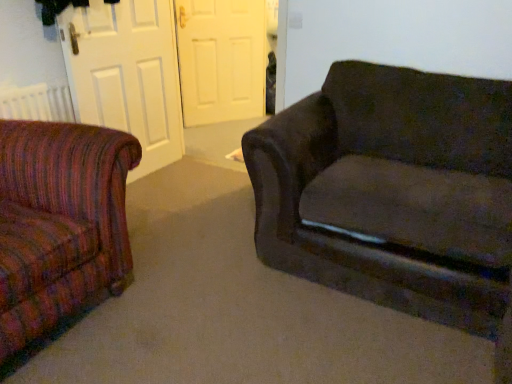
Question: Can you confirm if matte white door at left, which is the second screen door from back to front, is wider than white matte door at center, placed as the 1th screen door when sorted from back to front?

Choices:
 (A) no
 (B) yes

Answer: (A)

Question: Would you say matte white door at left, which ranks as the 1th screen door in front-to-back order, is a long distance from white matte door at center, placed as the 1th screen door when sorted from back to front?

Choices:
 (A) yes
 (B) no

Answer: (A)

Question: Is matte white door at left, which is the second screen door from back to front, surrounding white matte door at center, placed as the 1th screen door when sorted from back to front?

Choices:
 (A) no
 (B) yes

Answer: (A)

Question: Is matte white door at left, which is the second screen door from back to front, taller than white matte door at center, placed as the 1th screen door when sorted from back to front?

Choices:
 (A) no
 (B) yes

Answer: (B)

Question: Is matte white door at left, which ranks as the 1th screen door in front-to-back order, placed right next to white matte door at center, which appears as the second screen door when viewed from the front?

Choices:
 (A) yes
 (B) no

Answer: (B)

Question: Is matte white door at left, which ranks as the 1th screen door in front-to-back order, aimed at white matte door at center, placed as the 1th screen door when sorted from back to front?

Choices:
 (A) no
 (B) yes

Answer: (A)

Question: Does dark fabric couch at right have a greater height compared to white matte door at center, which appears as the second screen door when viewed from the front?

Choices:
 (A) no
 (B) yes

Answer: (A)

Question: Can white matte door at center, placed as the 1th screen door when sorted from back to front, be found inside dark fabric couch at right?

Choices:
 (A) no
 (B) yes

Answer: (A)

Question: From a real-world perspective, is dark fabric couch at right positioned under white matte door at center, placed as the 1th screen door when sorted from back to front, based on gravity?

Choices:
 (A) yes
 (B) no

Answer: (A)

Question: Are dark fabric couch at right and white matte door at center, which appears as the second screen door when viewed from the front, far apart?

Choices:
 (A) yes
 (B) no

Answer: (A)

Question: Does dark fabric couch at right touch white matte door at center, placed as the 1th screen door when sorted from back to front?

Choices:
 (A) no
 (B) yes

Answer: (A)

Question: Does dark fabric couch at right have a larger size compared to white matte door at center, placed as the 1th screen door when sorted from back to front?

Choices:
 (A) yes
 (B) no

Answer: (A)

Question: Does white matte door at center, which appears as the second screen door when viewed from the front, have a lesser height compared to dark fabric couch at right?

Choices:
 (A) no
 (B) yes

Answer: (A)